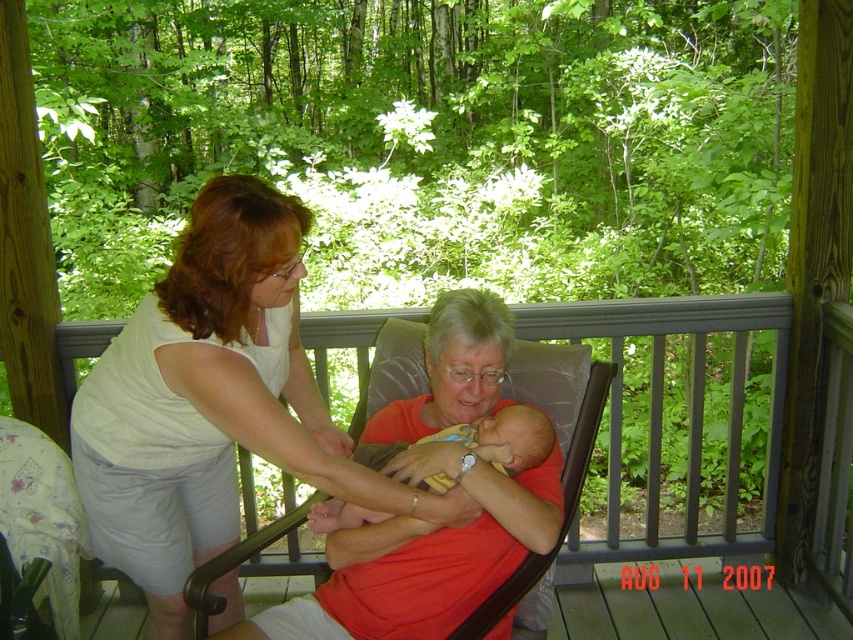
Consider the image. You are a photographer standing on the porch and want to take a photo of the brown leather chair at center and the soft yellow fabric baby at center. Which object should you focus on first if you want to capture both in sharp focus?

The brown leather chair at center is below the soft yellow fabric baby at center, so you should focus on the brown leather chair at center first since it is closer to the camera.

You are standing on the porch and want to hand a toy to the soft yellow fabric baby at center. To your right, there is a gray fabric chair at center. Which direction should you move to reach the baby first without going around the chair?

Since the gray fabric chair at center is to the left of the soft yellow fabric baby at center, you should move to your right to reach the baby first without going around the chair.

You are standing on the porch and want to place a small potted plant exactly at the point marked as point (x=560, y=467). Is there an object already located at that point?

Yes, there is a gray fabric chair at center located at point (x=560, y=467).